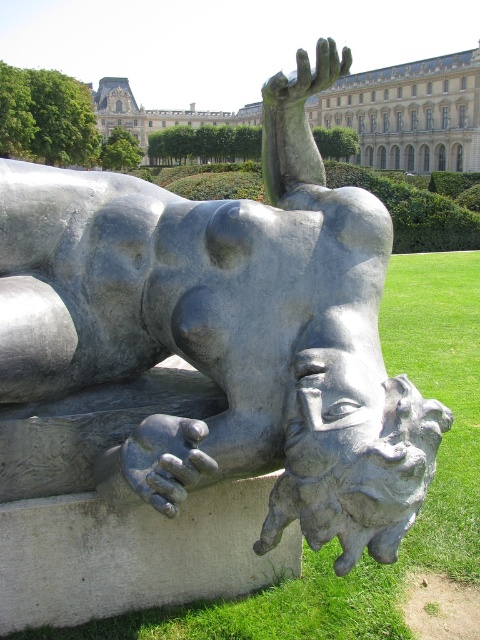
You are an art student who wants to measure the distance between the two hands in the sculpture. You have a measuring tape that can extend up to 3 meters. Can you measure the distance between the polished silver hand at lower center and the gray stone hand at upper center without needing to extend it beyond its limit?

The distance between the polished silver hand at lower center and the gray stone hand at upper center is 3.21 meters. Since your measuring tape can only extend up to 3 meters, you will need a longer measuring tape to measure the full distance between them.

You are an art student analyzing the sculpture. You notice two hands in the sculpture, the polished silver hand at lower center and the gray stone hand at upper center. Which hand is shorter?

The polished silver hand at lower center is shorter than the gray stone hand at upper center.

You are a maintenance worker standing 10 feet away from the base of the sculpture. You need to reach the polished silver hand at lower center for cleaning. Can you safely reach it without moving closer than your current position?

The distance of the polished silver hand at lower center from viewer is 14.20 feet. Since you are currently 10 feet away, you are 4.2 feet closer than the hand, so you can safely reach it without needing to move closer.